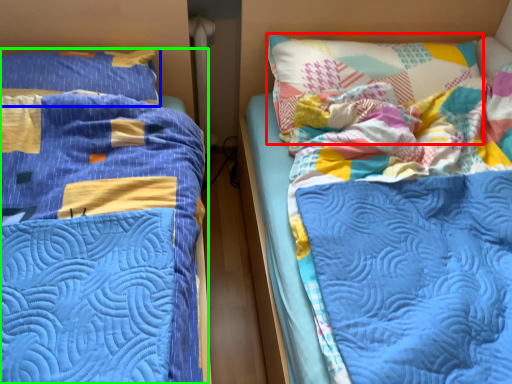
Question: Estimate the real-world distances between objects in this image. Which object is closer to pillow (highlighted by a red box), pillow (highlighted by a blue box) or bed (highlighted by a green box)?

Choices:
 (A) pillow
 (B) bed

Answer: (B)